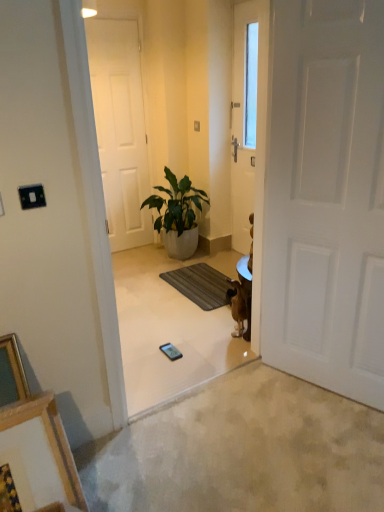
What are the coordinates of `free space in front of white matte door at right, the 1th door viewed from the right` in the screenshot? It's located at (326, 435).